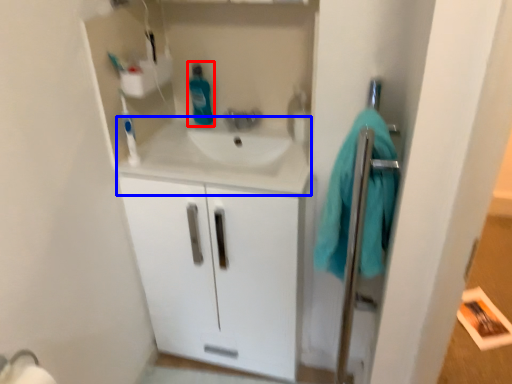
Question: Which object appears closest to the camera in this image, cleaning product (highlighted by a red box) or counter top (highlighted by a blue box)?

Choices:
 (A) cleaning product
 (B) counter top

Answer: (B)